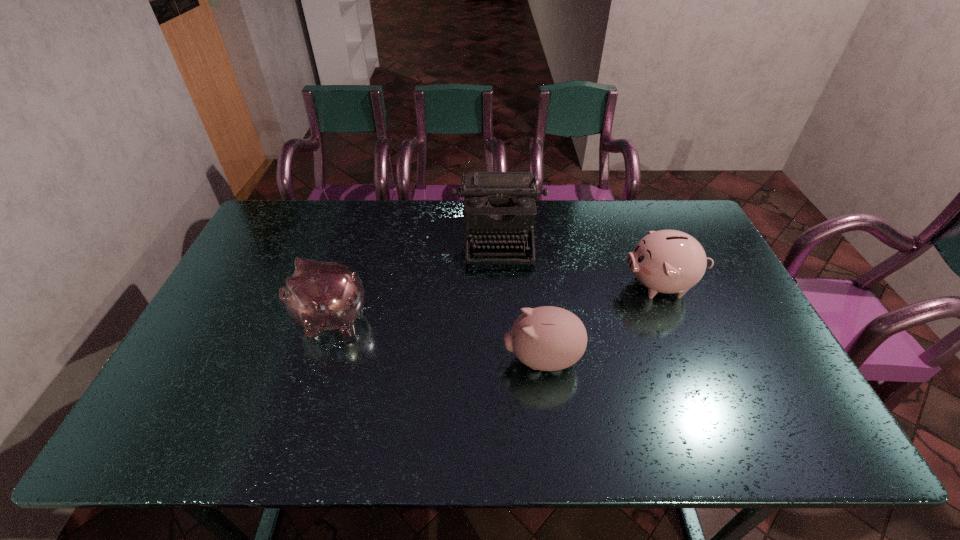
Where is `the leftmost object`? The height and width of the screenshot is (540, 960). the leftmost object is located at coordinates (321, 296).

Locate an element on the screen. typewriter is located at coordinates (499, 206).

Locate an element on the screen. This screenshot has height=540, width=960. the rightmost object is located at coordinates (666, 261).

Locate an element on the screen. The height and width of the screenshot is (540, 960). the second piggy bank from right to left is located at coordinates (547, 338).

The height and width of the screenshot is (540, 960). What are the coordinates of `vacant area situated 0.140m on the front facing side of the leftmost object` in the screenshot? It's located at (241, 319).

Image resolution: width=960 pixels, height=540 pixels. I want to click on vacant point located on the front facing side of the leftmost object, so click(x=223, y=319).

Find the location of `vacant space located 0.050m on the front facing side of the leftmost object`. vacant space located 0.050m on the front facing side of the leftmost object is located at coordinates (274, 319).

Identify the location of vacant space located on the typing side of the typewriter. Image resolution: width=960 pixels, height=540 pixels. (503, 338).

Where is `blank space located 0.300m on the left of the rightmost object`? Image resolution: width=960 pixels, height=540 pixels. blank space located 0.300m on the left of the rightmost object is located at coordinates (521, 285).

Locate an element on the screen. The image size is (960, 540). vacant space located 0.390m at the snout of the second piggy bank from right to left is located at coordinates (348, 359).